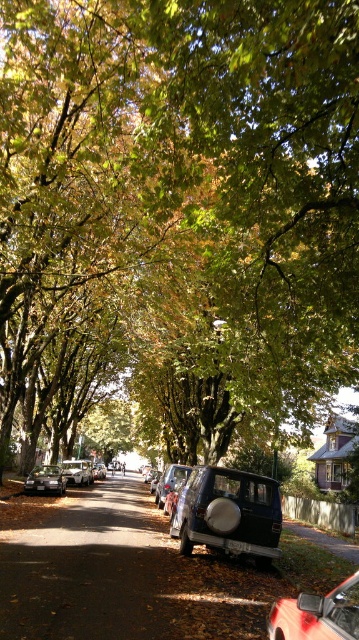
You are standing on the sidewalk and see both the metallic red car at center and the matte black car at center. Which car is nearer to you?

The metallic red car at center is closer to the viewer than the matte black car at center, so the metallic red car at center is nearer to you.

You are a delivery driver who needs to park your van, which is 5 meters long, in this street. You see the metallic silver suv at center and the matte black car at center. Which vehicle takes up more space in the parking spot, making it harder to maneuver around?

The matte black car at center occupies more space than the metallic silver suv at center, so it would be harder to maneuver around the matte black car at center.

You are a delivery person trying to park a 2.5 meter tall delivery van in this street. You see the metallic silver suv at center and the matte black car at center. Which vehicle should you avoid parking next to to ensure there is enough vertical clearance for your van?

The metallic silver suv at center is much taller than the matte black car at center. To ensure enough vertical clearance for your 2.5 meter tall delivery van, you should avoid parking next to the metallic silver suv at center because it is taller and may have less available space above it.